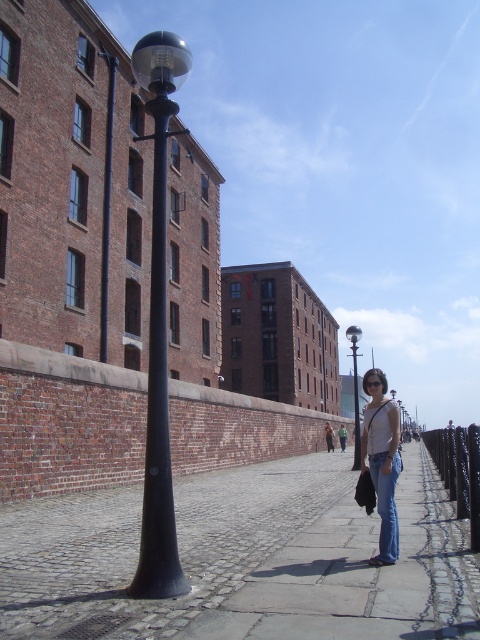
You are standing at the entrance of the large brick building and want to walk to the cobblestone pavement at center. According to the image, in which direction should you head from the building?

The cobblestone pavement at center is located at point (x=292, y=563), so you should head towards the center of the image from the building.